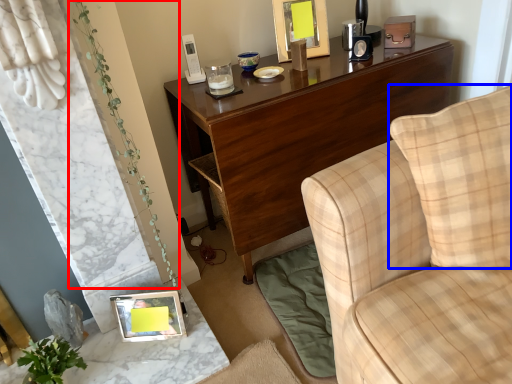
Question: Which object appears closest to the camera in this image, plant (highlighted by a red box) or pillow (highlighted by a blue box)?

Choices:
 (A) plant
 (B) pillow

Answer: (B)